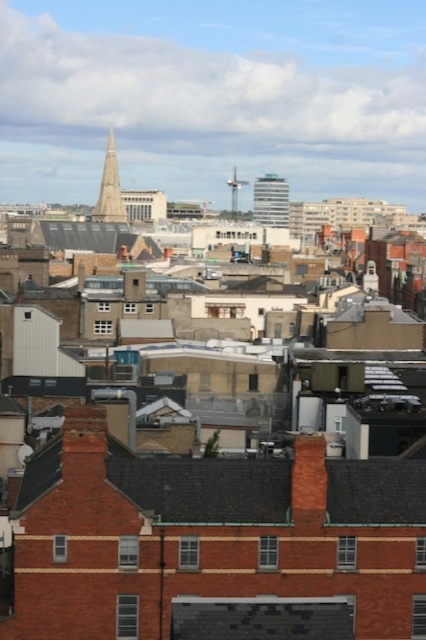
Question: Can you confirm if smooth glass spire at center is positioned below shiny silver spire at center?

Choices:
 (A) yes
 (B) no

Answer: (A)

Question: Does white glass building at center appear under smooth glass spire at center?

Choices:
 (A) no
 (B) yes

Answer: (A)

Question: Which of these objects is positioned closest to the shiny silver spire at center?

Choices:
 (A) white glass building at center
 (B) smooth glass spire at center
 (C) red brick roof at lower left

Answer: (A)

Question: Among these points, which one is nearest to the camera?

Choices:
 (A) (118, 209)
 (B) (247, 465)
 (C) (233, 173)

Answer: (B)

Question: Among these objects, which one is nearest to the camera?

Choices:
 (A) white glass building at center
 (B) shiny silver spire at center
 (C) red brick roof at lower left
 (D) smooth glass spire at center

Answer: (C)

Question: Does white glass building at center have a lesser width compared to smooth glass spire at center?

Choices:
 (A) yes
 (B) no

Answer: (A)